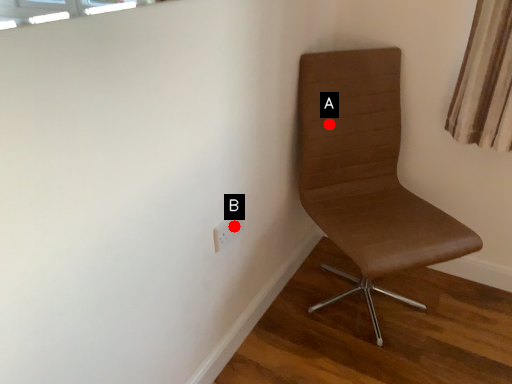
Question: Two points are circled on the image, labeled by A and B beside each circle. Which point is closer to the camera taking this photo?

Choices:
 (A) A is closer
 (B) B is closer

Answer: (B)